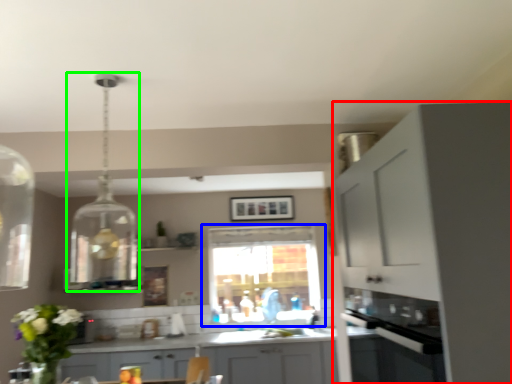
Question: Estimate the real-world distances between objects in this image. Which object is closer to cabinetry (highlighted by a red box), window (highlighted by a blue box) or light fixture (highlighted by a green box)?

Choices:
 (A) window
 (B) light fixture

Answer: (B)